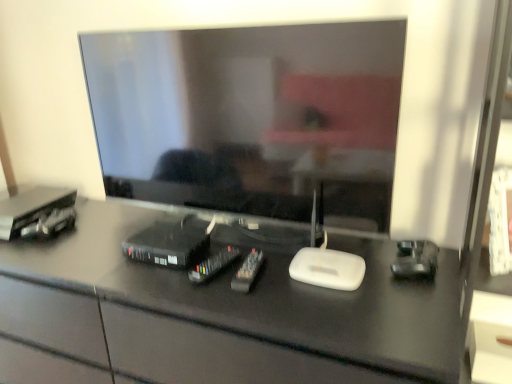
The image size is (512, 384). Find the location of `free space between black plastic remote control at center, the 3th equipment in the left-to-right sequence, and black plastic remote controls at center, the 1th equipment when ordered from right to left`. free space between black plastic remote control at center, the 3th equipment in the left-to-right sequence, and black plastic remote controls at center, the 1th equipment when ordered from right to left is located at coordinates (225, 280).